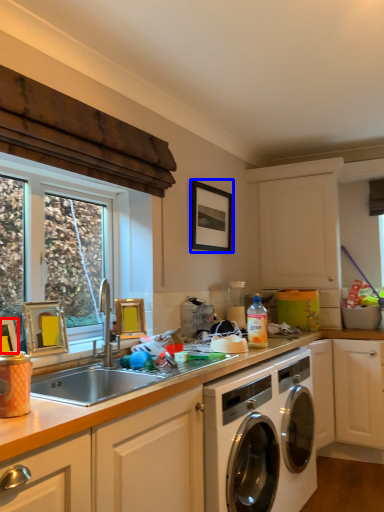
Question: Among these objects, which one is nearest to the camera, picture frame (highlighted by a red box) or picture frame (highlighted by a blue box)?

Choices:
 (A) picture frame
 (B) picture frame

Answer: (A)